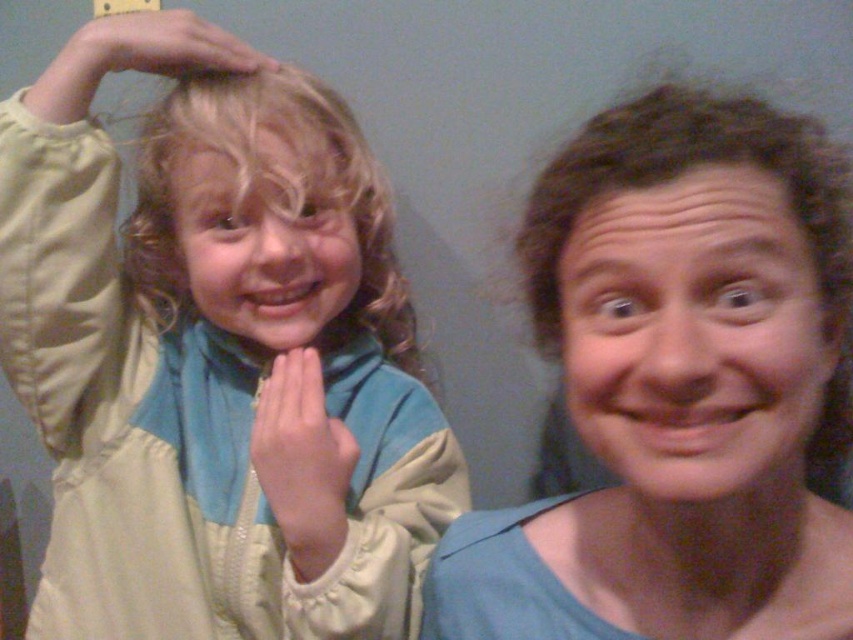
Question: Among these objects, which one is nearest to the camera?

Choices:
 (A) matte blue shirt at center
 (B) matte yellow hand at upper left
 (C) matte beige jacket at left

Answer: (A)

Question: Does pink flesh-toned hand at center have a smaller size compared to matte yellow hand at upper left?

Choices:
 (A) no
 (B) yes

Answer: (A)

Question: Which point appears closest to the camera in this image?

Choices:
 (A) (305, 346)
 (B) (140, 44)

Answer: (B)

Question: Which object appears farthest from the camera in this image?

Choices:
 (A) matte blue shirt at center
 (B) matte beige jacket at left

Answer: (B)

Question: In this image, where is matte blue shirt at center located relative to blonde curly hair at upper left?

Choices:
 (A) below
 (B) above

Answer: (A)

Question: Does matte beige jacket at left appear on the left side of matte blue shirt at center?

Choices:
 (A) yes
 (B) no

Answer: (A)